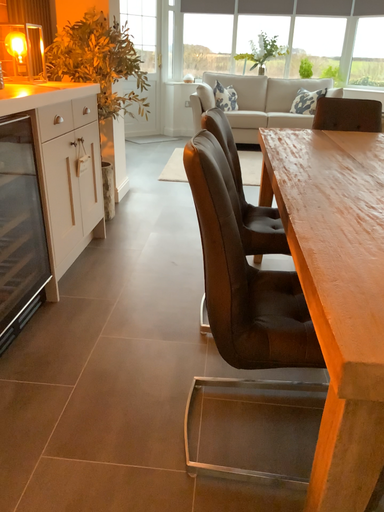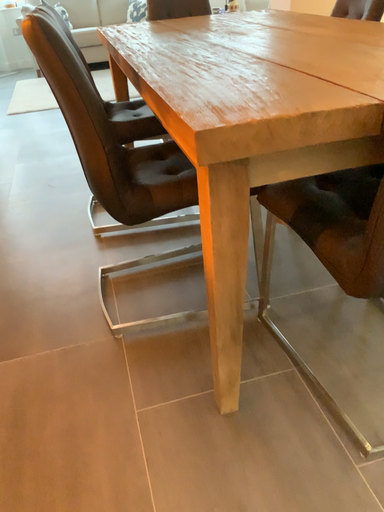
Question: Which way did the camera rotate in the video?

Choices:
 (A) rotated right
 (B) rotated left

Answer: (A)